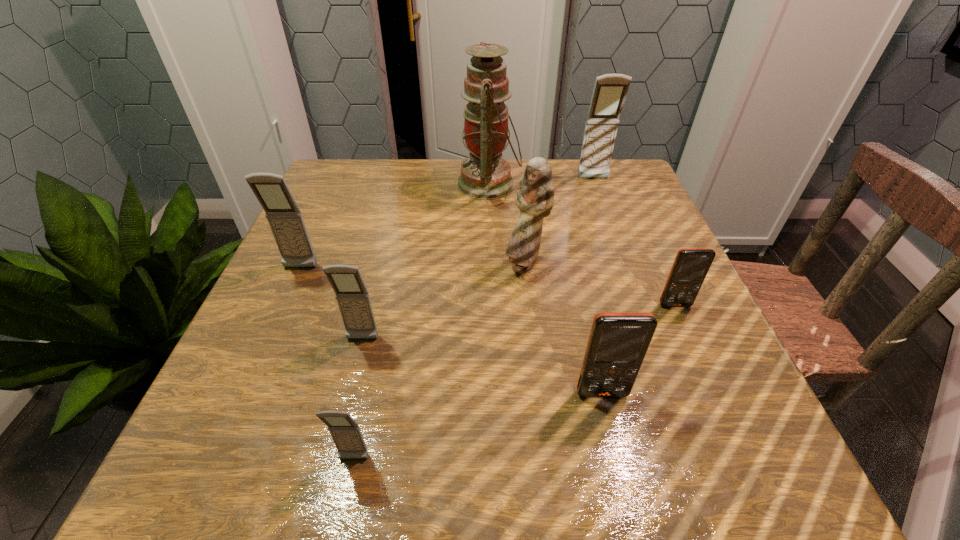
The image size is (960, 540). Find the location of `the nearer orange cellular telephone`. the nearer orange cellular telephone is located at coordinates (618, 342).

I want to click on the smaller orange cellular telephone, so click(x=691, y=265).

Where is `the right orange cellular telephone`? the right orange cellular telephone is located at coordinates (691, 265).

Image resolution: width=960 pixels, height=540 pixels. In order to click on the nearest cellular telephone in this screenshot , I will do `click(347, 436)`.

Locate an element on the screen. Image resolution: width=960 pixels, height=540 pixels. the nearest object is located at coordinates (347, 436).

Image resolution: width=960 pixels, height=540 pixels. In order to click on free space located 0.290m on the left of the tallest object in this screenshot , I will do `click(345, 185)`.

I want to click on vacant space located on the front-facing side of the farthest gray cellular telephone, so click(633, 287).

What are the coordinates of `free point located 0.120m on the front-facing side of the figurine` in the screenshot? It's located at (531, 328).

This screenshot has width=960, height=540. I want to click on free location located 0.050m on the front-facing side of the third nearest gray cellular telephone, so click(290, 291).

Image resolution: width=960 pixels, height=540 pixels. I want to click on vacant position located on the front-facing side of the third nearest object, so click(348, 396).